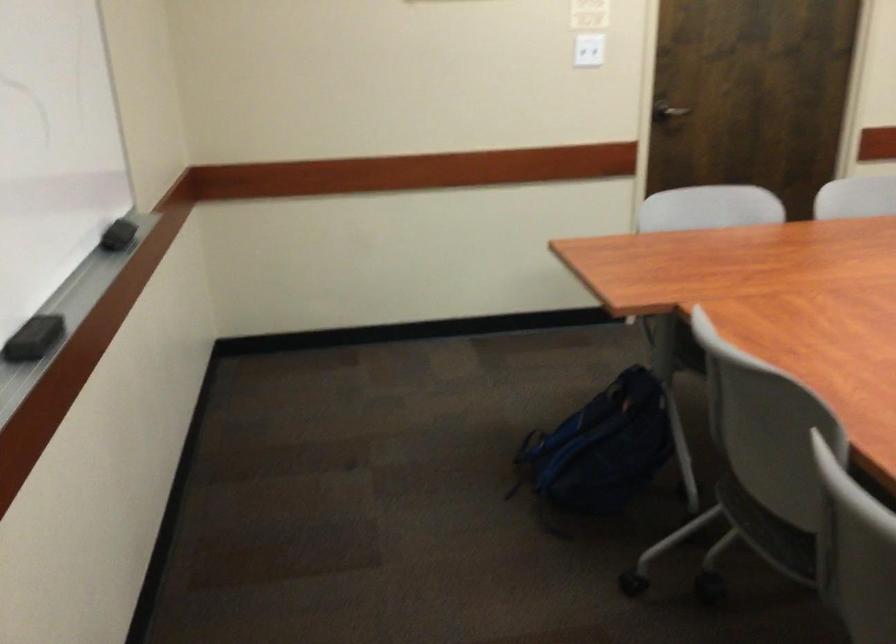
The width and height of the screenshot is (896, 644). Describe the element at coordinates (667, 111) in the screenshot. I see `the silver door handle` at that location.